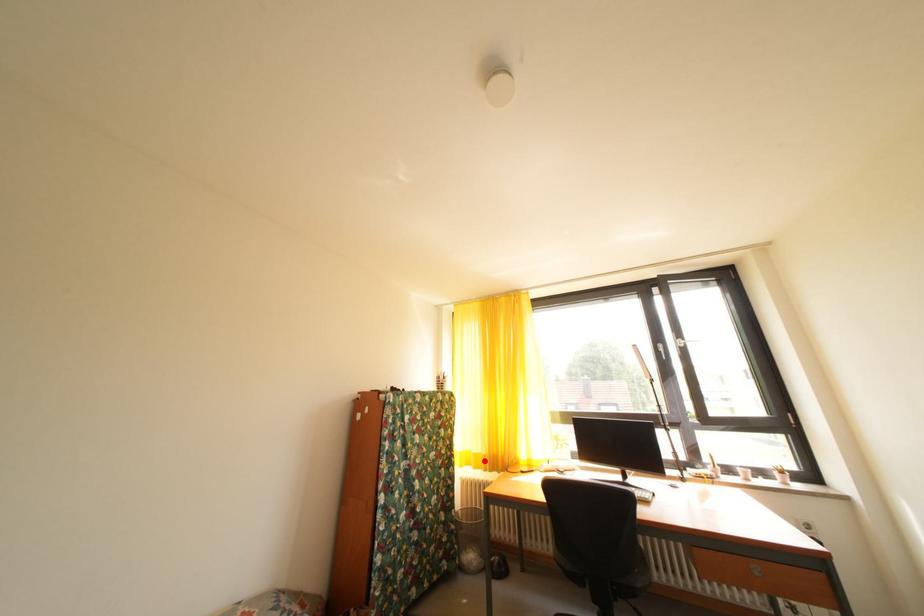
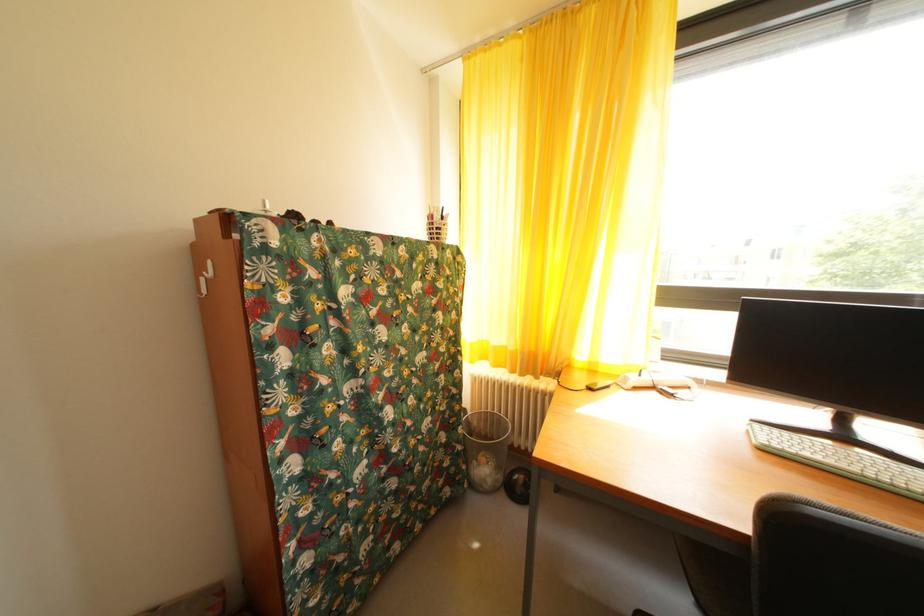
In the second image, find the point that corresponds to the highlighted location in the first image.

(505, 354)